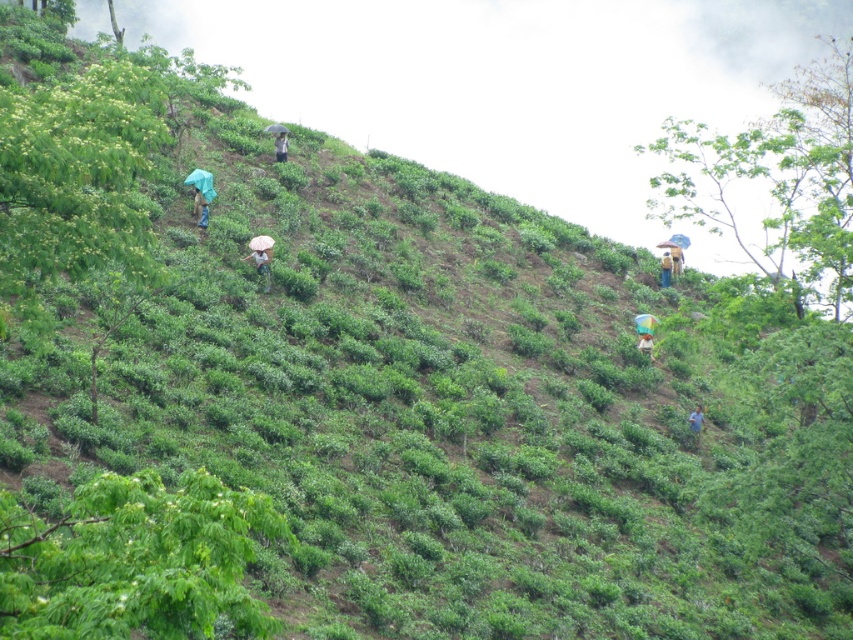
Question: Does green fabric umbrella at upper left appear over green fabric umbrella at upper center?

Choices:
 (A) no
 (B) yes

Answer: (A)

Question: Does white fabric umbrella at center appear on the left side of blue fabric umbrella at upper right?

Choices:
 (A) no
 (B) yes

Answer: (B)

Question: Which of the following is the closest to the observer?

Choices:
 (A) light brown fabric at center
 (B) blue fabric umbrella at upper right

Answer: (A)

Question: Is green fabric umbrella at upper left further to camera compared to green fabric umbrella at upper center?

Choices:
 (A) yes
 (B) no

Answer: (B)

Question: Which object appears farthest from the camera in this image?

Choices:
 (A) blue fabric umbrella at lower right
 (B) green fabric umbrella at upper left
 (C) white fabric umbrella at center
 (D) light brown fabric at center

Answer: (D)

Question: Which point is farther from the camera taking this photo?

Choices:
 (A) pos(670,264)
 (B) pos(256,244)
 (C) pos(277,144)

Answer: (A)